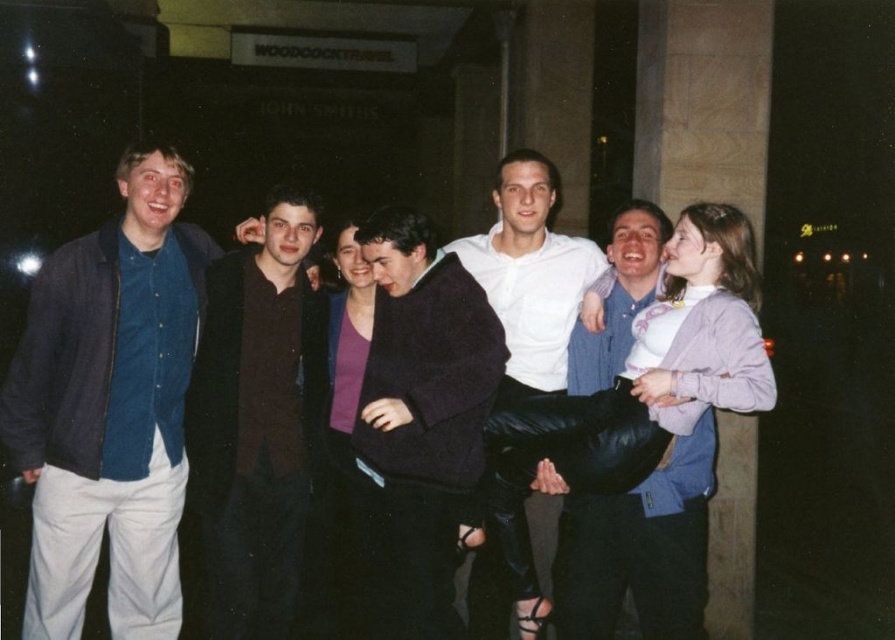
Who is positioned more to the left, white matte shirt at center or purple matte sweater at center?

purple matte sweater at center

Is white matte shirt at center to the left of purple matte sweater at center from the viewer's perspective?

Incorrect, white matte shirt at center is not on the left side of purple matte sweater at center.

Image resolution: width=895 pixels, height=640 pixels. Describe the element at coordinates (530, 273) in the screenshot. I see `white matte shirt at center` at that location.

Locate an element on the screen. Image resolution: width=895 pixels, height=640 pixels. white matte shirt at center is located at coordinates (530, 273).

Does matte blue shirt at left have a lesser width compared to dark brown leather jacket at center?

In fact, matte blue shirt at left might be wider than dark brown leather jacket at center.

Does matte blue shirt at left appear on the right side of dark brown leather jacket at center?

In fact, matte blue shirt at left is to the left of dark brown leather jacket at center.

Does point (143, 429) lie in front of point (276, 380)?

That is True.

Locate an element on the screen. matte blue shirt at left is located at coordinates (109, 406).

Does light purple sweater at center have a greater width compared to purple matte sweater at center?

Yes, light purple sweater at center is wider than purple matte sweater at center.

Does light purple sweater at center lie in front of purple matte sweater at center?

Yes, light purple sweater at center is closer to the viewer.

Is point (585, 509) behind point (354, 358)?

No, (585, 509) is in front of (354, 358).

In order to click on light purple sweater at center in this screenshot , I will do `click(706, 324)`.